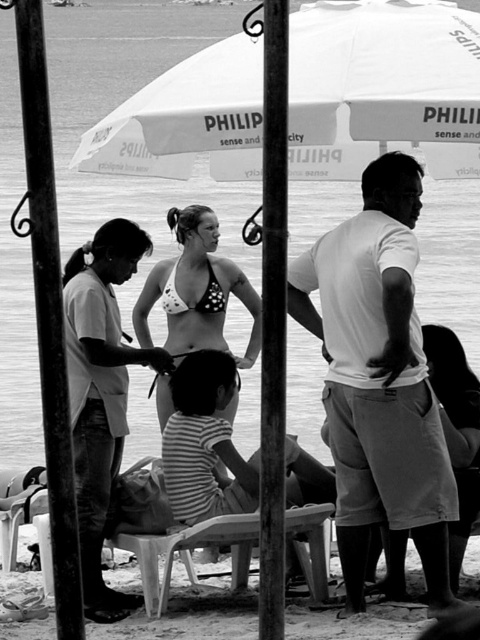
Question: Which of the following is the closest to the observer?

Choices:
 (A) matte white bikini at center
 (B) polka dot bikini top at center

Answer: (A)

Question: Can you confirm if white cotton shirt at right is wider than matte white bikini at center?

Choices:
 (A) no
 (B) yes

Answer: (B)

Question: Does white fabric umbrella at upper center have a larger size compared to polka dot bikini top at center?

Choices:
 (A) no
 (B) yes

Answer: (B)

Question: Which point appears farthest from the camera in this image?

Choices:
 (A) [396, 84]
 (B) [87, 561]
 (C) [419, 348]

Answer: (B)

Question: Which object appears farthest from the camera in this image?

Choices:
 (A) matte white bikini at center
 (B) polka dot bikini top at center
 (C) white fabric umbrella at upper center
 (D) white cotton shirt at right

Answer: (B)

Question: Does white fabric umbrella at upper center have a smaller size compared to white cotton shirt at right?

Choices:
 (A) yes
 (B) no

Answer: (B)